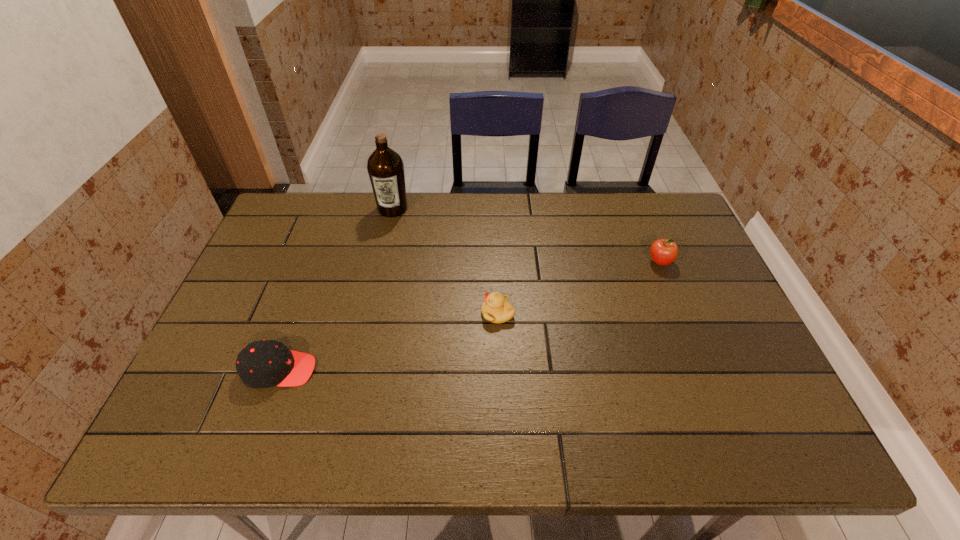
This screenshot has height=540, width=960. In order to click on vacant space located on the front-facing side of the leftmost object in this screenshot , I will do `click(454, 370)`.

Locate an element on the screen. This screenshot has width=960, height=540. vacant space located 0.090m on the front-facing side of the third object from left to right is located at coordinates (447, 313).

At what (x,y) coordinates should I click in order to perform the action: click on vacant region located on the front-facing side of the third object from left to right. Please return your answer as a coordinate pair (x, y). This screenshot has width=960, height=540. Looking at the image, I should click on (330, 313).

Locate an element on the screen. This screenshot has width=960, height=540. vacant space situated on the front-facing side of the third object from left to right is located at coordinates (330, 313).

At what (x,y) coordinates should I click in order to perform the action: click on object situated at the far edge. Please return your answer as a coordinate pair (x, y). The width and height of the screenshot is (960, 540). Looking at the image, I should click on (385, 167).

At what (x,y) coordinates should I click in order to perform the action: click on object at the left edge. Please return your answer as a coordinate pair (x, y). This screenshot has height=540, width=960. Looking at the image, I should click on (265, 363).

The height and width of the screenshot is (540, 960). Identify the location of object that is positioned at the right edge. (663, 252).

Identify the location of free spot at the far edge of the desktop. (556, 204).

Image resolution: width=960 pixels, height=540 pixels. Identify the location of vacant space at the near edge of the desktop. (578, 436).

Find the location of a particular element. This screenshot has width=960, height=540. vacant space at the left edge of the desktop is located at coordinates (260, 334).